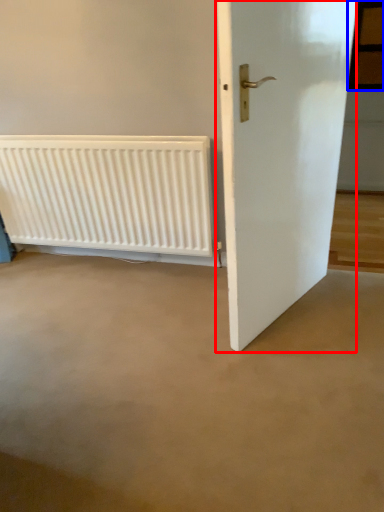
Question: Which point is further to the camera, door (highlighted by a red box) or window (highlighted by a blue box)?

Choices:
 (A) door
 (B) window

Answer: (B)